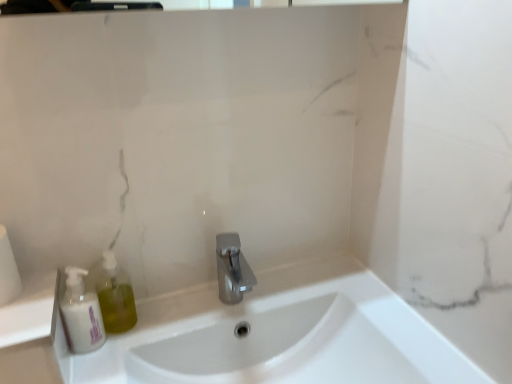
Question: Is white glossy sink at center closer to the viewer compared to white matte toilet paper at left?

Choices:
 (A) no
 (B) yes

Answer: (B)

Question: Does white glossy sink at center have a lesser height compared to white matte toilet paper at left?

Choices:
 (A) yes
 (B) no

Answer: (B)

Question: From the image's perspective, is white glossy sink at center on top of white matte toilet paper at left?

Choices:
 (A) yes
 (B) no

Answer: (B)

Question: Does white glossy sink at center contain white matte toilet paper at left?

Choices:
 (A) no
 (B) yes

Answer: (A)

Question: Is white glossy sink at center taller than white matte toilet paper at left?

Choices:
 (A) no
 (B) yes

Answer: (B)

Question: Does white glossy sink at center come behind white matte toilet paper at left?

Choices:
 (A) no
 (B) yes

Answer: (A)

Question: Is white matte toilet paper at left at the left side of polished metallic faucet at center?

Choices:
 (A) no
 (B) yes

Answer: (B)

Question: From the image's perspective, is white matte toilet paper at left over polished metallic faucet at center?

Choices:
 (A) no
 (B) yes

Answer: (B)

Question: Is white matte toilet paper at left aimed at polished metallic faucet at center?

Choices:
 (A) no
 (B) yes

Answer: (A)

Question: Considering the relative positions of white matte toilet paper at left and polished metallic faucet at center in the image provided, is white matte toilet paper at left behind polished metallic faucet at center?

Choices:
 (A) yes
 (B) no

Answer: (B)

Question: Considering the relative positions of white matte toilet paper at left and polished metallic faucet at center in the image provided, is white matte toilet paper at left to the right of polished metallic faucet at center from the viewer's perspective?

Choices:
 (A) no
 (B) yes

Answer: (A)

Question: From the image's perspective, is white matte toilet paper at left located beneath polished metallic faucet at center?

Choices:
 (A) no
 (B) yes

Answer: (A)

Question: Can you confirm if white matte toilet paper at left is positioned to the right of white glossy sink at center?

Choices:
 (A) yes
 (B) no

Answer: (B)